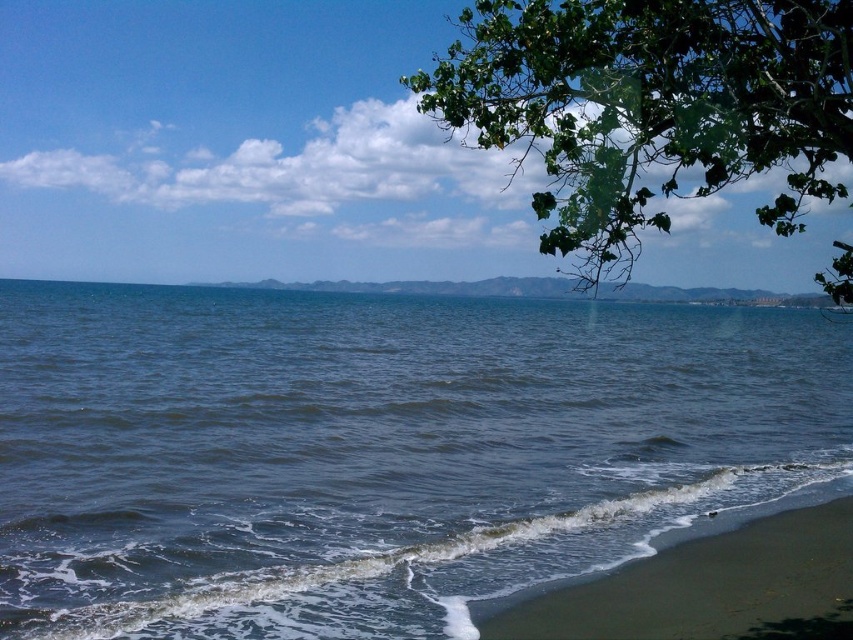
You are a photographer standing on the beach and want to capture the dark blue water at lower center in your photo. Based on its 2D location coordinates, where should you position your camera to ensure it is centered in the frame?

The dark blue water at lower center is located at coordinates point (379, 451). To center it in the frame, position your camera so that the center of the viewfinder aligns with this point.

You are a photographer aiming to capture the dark blue water at lower center and the green leafy tree at upper right in a single frame. Considering their sizes in the scene, which object would appear smaller in your photo?

The dark blue water at lower center would appear smaller in the photo because it has a smaller size compared to the green leafy tree at upper right.

You are a photographer standing at the beach and want to take a photo of the two points mentioned. Which point is closer to your camera, point (660, 307) or point (740, 54)?

Point (740, 54) is closer to the camera because the description states that point (660, 307) is further away.